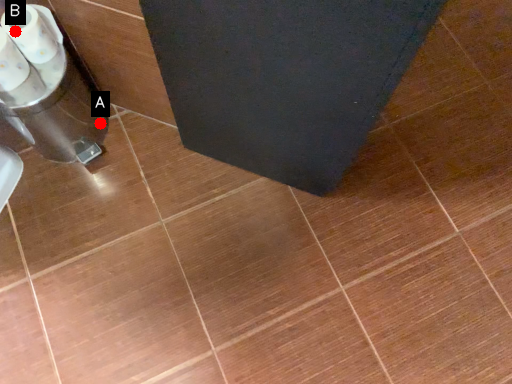
Question: Two points are circled on the image, labeled by A and B beside each circle. Which point is closer to the camera taking this photo?

Choices:
 (A) A is closer
 (B) B is closer

Answer: (B)